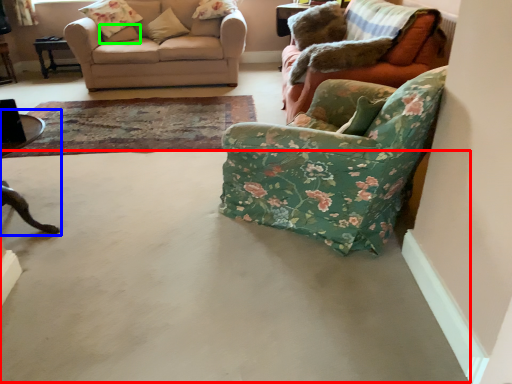
Question: Which object is the closest to the concrete (highlighted by a red box)? Choose among these: table (highlighted by a blue box) or pillow (highlighted by a green box).

Choices:
 (A) table
 (B) pillow

Answer: (A)